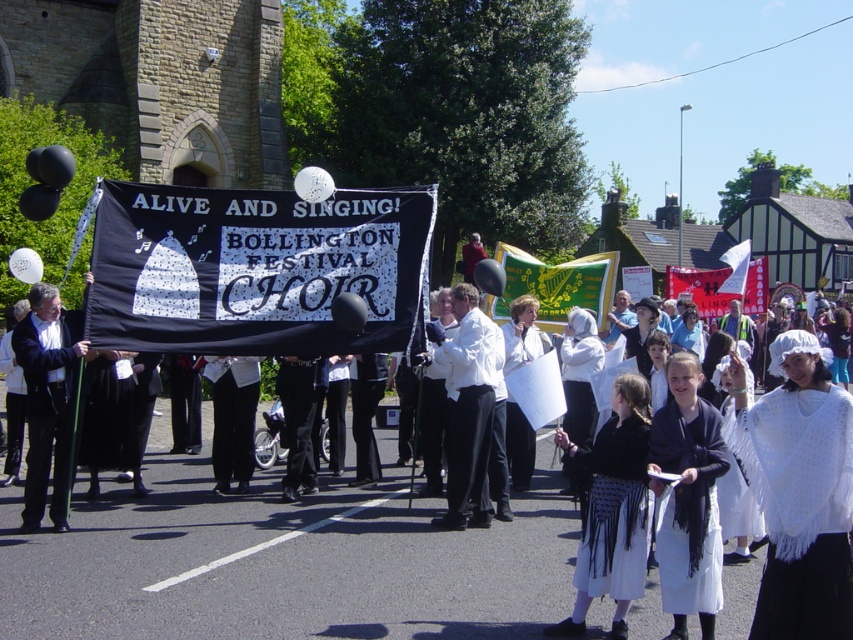
Question: Can you confirm if black fringed skirt at lower center is wider than white satin shirt at center?

Choices:
 (A) yes
 (B) no

Answer: (B)

Question: Which of the following is the farthest from the observer?

Choices:
 (A) (656, 440)
 (B) (508, 333)

Answer: (B)

Question: Which of the following is the closest to the observer?

Choices:
 (A) (514, 477)
 (B) (55, 349)
 (C) (595, 541)
 (D) (305, 468)

Answer: (C)

Question: Does white satin shirt at center appear over white fabric at center?

Choices:
 (A) no
 (B) yes

Answer: (A)

Question: Is white knitted shawl at center to the left of white woolen shawl at center from the viewer's perspective?

Choices:
 (A) no
 (B) yes

Answer: (A)

Question: Which point is farther to the camera?

Choices:
 (A) (784, 545)
 (B) (294, 481)
 (C) (664, 420)
 (D) (526, 468)

Answer: (D)